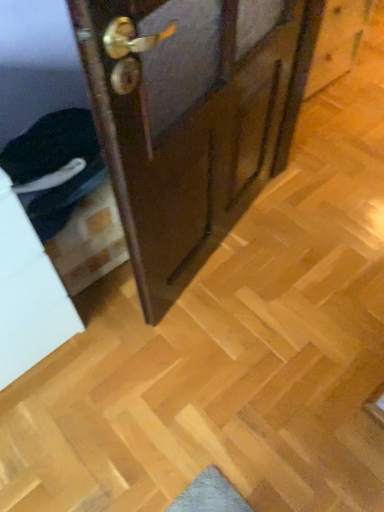
Question: Is wooden door at center inside or outside of white matte drawer at lower left?

Choices:
 (A) inside
 (B) outside

Answer: (B)

Question: Would you say wooden door at center is to the left or to the right of white matte drawer at lower left in the picture?

Choices:
 (A) right
 (B) left

Answer: (A)

Question: In terms of width, does wooden door at center look wider or thinner when compared to white matte drawer at lower left?

Choices:
 (A) thin
 (B) wide

Answer: (A)

Question: Considering their positions, is white matte drawer at lower left located in front of or behind wooden door at center?

Choices:
 (A) behind
 (B) front

Answer: (A)

Question: From the image's perspective, is white matte drawer at lower left positioned above or below wooden door at center?

Choices:
 (A) above
 (B) below

Answer: (B)

Question: Is point (3, 328) closer or farther from the camera than point (238, 155)?

Choices:
 (A) closer
 (B) farther

Answer: (A)

Question: In the image, is white matte drawer at lower left on the left side or the right side of wooden door at center?

Choices:
 (A) right
 (B) left

Answer: (B)